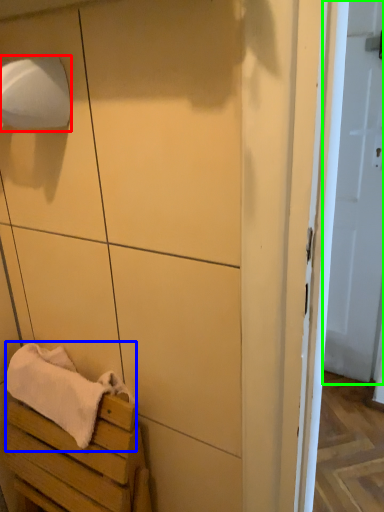
Question: Which object is positioned farthest from toilet paper (highlighted by a red box)? Select from bath towel (highlighted by a blue box) and door (highlighted by a green box).

Choices:
 (A) bath towel
 (B) door

Answer: (B)